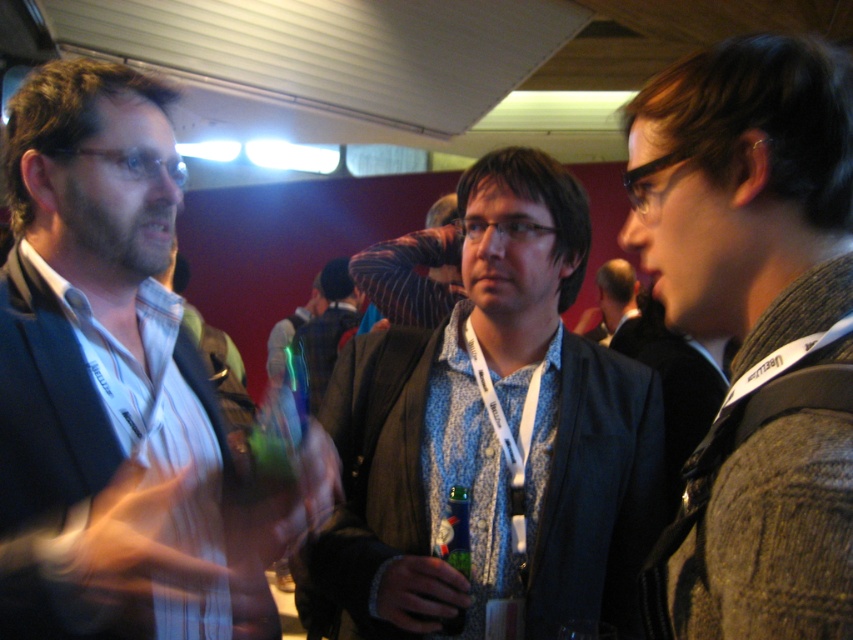
From the picture: Can you confirm if knitted gray sweater at right is smaller than light brown leather jacket at center?

Yes.

Who is lower down, knitted gray sweater at right or light brown leather jacket at center?

knitted gray sweater at right is lower down.

Which is behind, point (821, 48) or point (335, 316)?

The point (335, 316) is more distant.

The width and height of the screenshot is (853, 640). Identify the location of knitted gray sweater at right. coord(755,323).

Which of these two, blue patterned shirt at center or light brown leather jacket at center, stands shorter?

blue patterned shirt at center

I want to click on blue patterned shirt at center, so click(492, 435).

Is point (471, 392) closer to viewer compared to point (345, 300)?

Yes, point (471, 392) is in front of point (345, 300).

You are a GUI agent. You are given a task and a screenshot of the screen. Output one action in this format:
    pyautogui.click(x=<x>, y=<y>)
    Task: Click on the blue patterned shirt at center
    The image size is (853, 640).
    Given the screenshot: What is the action you would take?
    pyautogui.click(x=492, y=435)

In the scene shown: Between matte black jacket at left and light brown leather jacket at center, which one has more height?

With more height is light brown leather jacket at center.

Does point (79, 502) lie behind point (328, 339)?

No.

What do you see at coordinates (119, 388) in the screenshot? I see `matte black jacket at left` at bounding box center [119, 388].

Identify the location of matte black jacket at left. (119, 388).